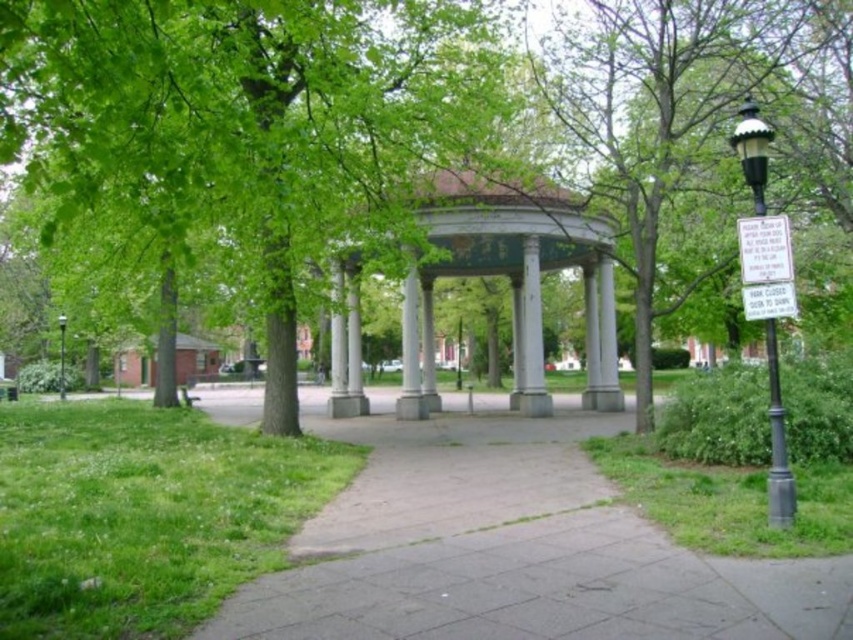
Question: Which of the following is the farthest from the observer?

Choices:
 (A) (770, 260)
 (B) (740, 522)
 (C) (459, 401)
 (D) (404, 189)

Answer: (C)

Question: Is white paper sign at right positioned in front of white marble column at center?

Choices:
 (A) yes
 (B) no

Answer: (A)

Question: Can you confirm if gray concrete pavement at center is bigger than green grass at lower left?

Choices:
 (A) no
 (B) yes

Answer: (B)

Question: Which point is closer to the camera taking this photo?

Choices:
 (A) (422, 417)
 (B) (764, 237)

Answer: (B)

Question: Which point is closer to the camera?

Choices:
 (A) (436, 116)
 (B) (39, 440)

Answer: (A)

Question: From the image, what is the correct spatial relationship of gray concrete pavement at center in relation to white marble gazebo at center?

Choices:
 (A) above
 (B) below

Answer: (B)